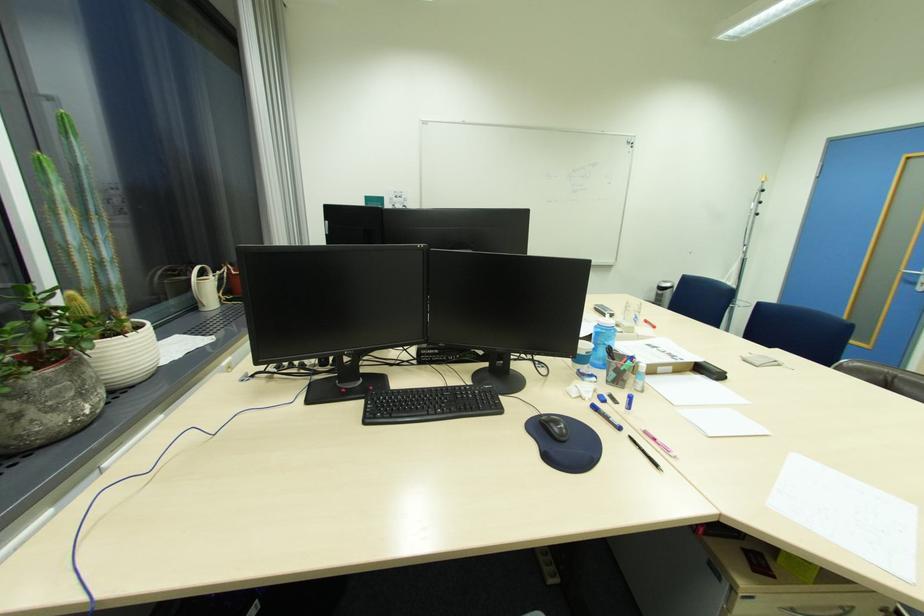
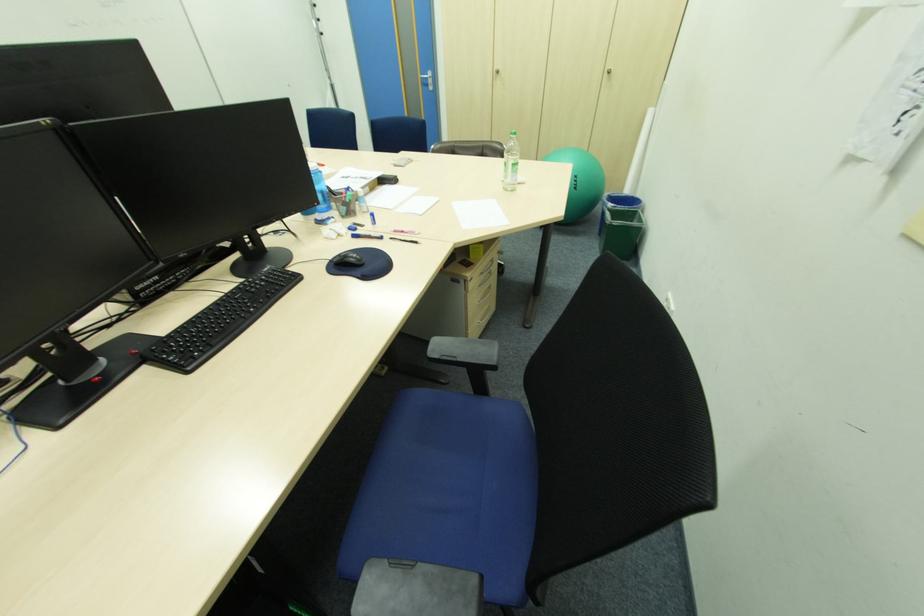
In the second image, find the point that corresponds to [562,429] in the first image.

(357, 260)